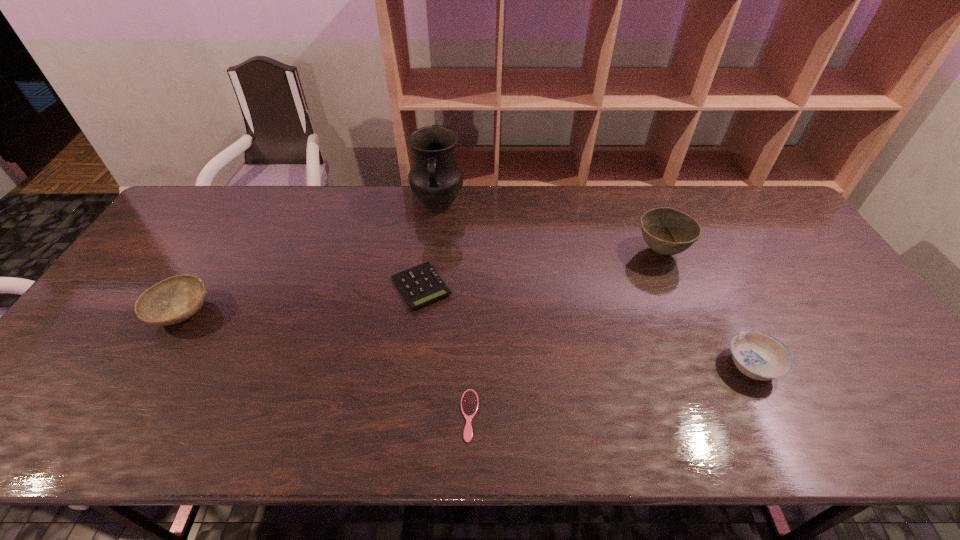
The width and height of the screenshot is (960, 540). I want to click on vacant space at the far edge of the desktop, so click(x=325, y=205).

Locate an element on the screen. The height and width of the screenshot is (540, 960). vacant space at the near edge of the desktop is located at coordinates (678, 440).

The height and width of the screenshot is (540, 960). I want to click on vacant space at the left edge of the desktop, so (x=121, y=300).

Where is `free space at the right edge of the desktop`? This screenshot has width=960, height=540. free space at the right edge of the desktop is located at coordinates (812, 299).

Where is `vacant space at the far left corner of the desktop`? The width and height of the screenshot is (960, 540). vacant space at the far left corner of the desktop is located at coordinates (196, 219).

Locate an element on the screen. blank space at the far right corner of the desktop is located at coordinates (730, 194).

In the image, there is a desktop. Where is `vacant space at the near right corner`? The height and width of the screenshot is (540, 960). vacant space at the near right corner is located at coordinates (939, 443).

Find the location of a particular element. This screenshot has height=540, width=960. free space between the shortest object and the pitcher is located at coordinates (454, 310).

Locate an element on the screen. Image resolution: width=960 pixels, height=540 pixels. vacant point located between the shortest object and the farthest object is located at coordinates (454, 310).

Where is `empty location between the leftmost bowl and the farthest object`? empty location between the leftmost bowl and the farthest object is located at coordinates (310, 259).